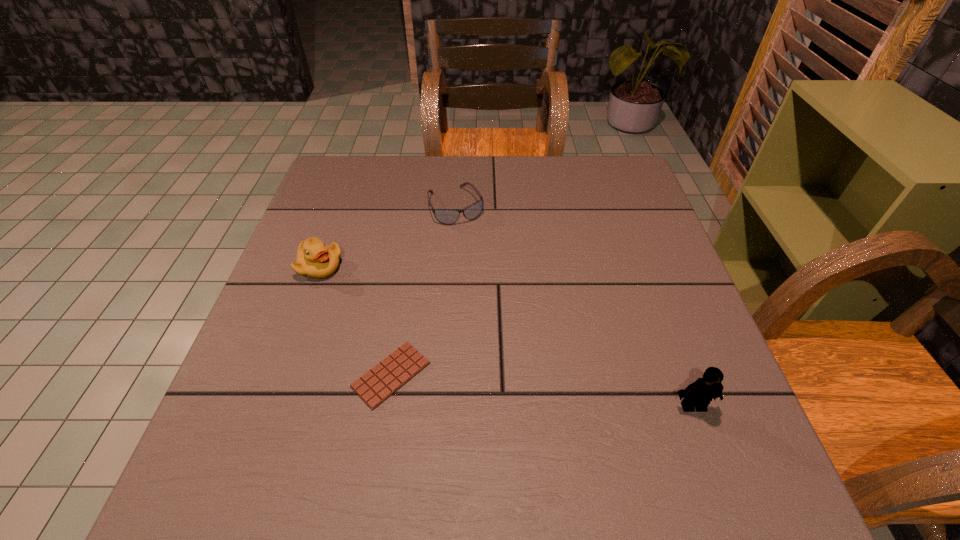
Identify the location of free space on the desktop that is between the candy bar and the Lego and is positioned on the front-facing side of the duckling. The width and height of the screenshot is (960, 540). (508, 387).

Locate an element on the screen. vacant space on the desktop that is between the candy bar and the Lego and is positioned on the lenses of the third tallest object is located at coordinates (552, 392).